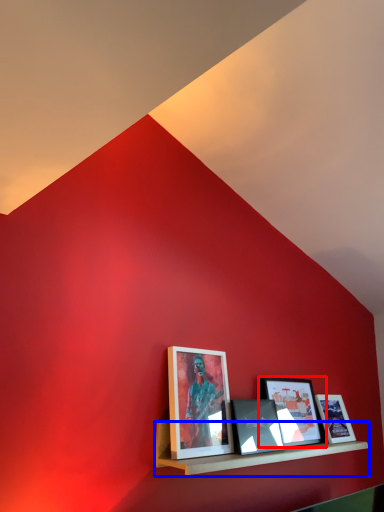
Question: Which object appears closest to the camera in this image, picture frame (highlighted by a red box) or shelf (highlighted by a blue box)?

Choices:
 (A) picture frame
 (B) shelf

Answer: (B)